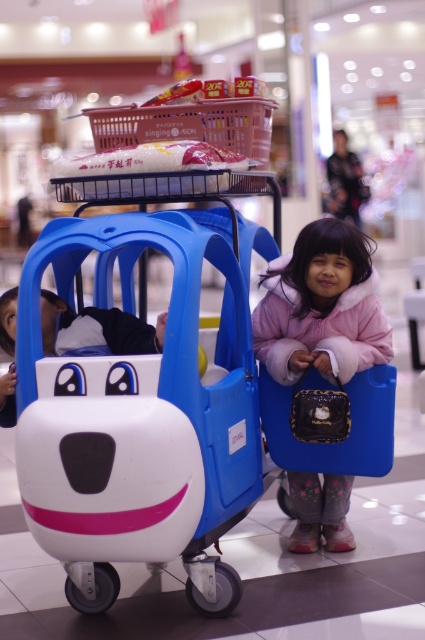
Question: Can you confirm if matte plastic baby carriage at center is positioned below pink fleece jacket at lower right?

Choices:
 (A) no
 (B) yes

Answer: (B)

Question: Is matte plastic baby carriage at center below pink fleece jacket at lower right?

Choices:
 (A) no
 (B) yes

Answer: (B)

Question: Which point is closer to the camera?

Choices:
 (A) pink fleece jacket at lower right
 (B) matte plastic baby carriage at center

Answer: (B)

Question: Which object is closer to the camera taking this photo?

Choices:
 (A) pink fleece jacket at lower right
 (B) matte plastic baby carriage at center

Answer: (B)

Question: Is matte plastic baby carriage at center to the left of pink fleece jacket at lower right from the viewer's perspective?

Choices:
 (A) yes
 (B) no

Answer: (A)